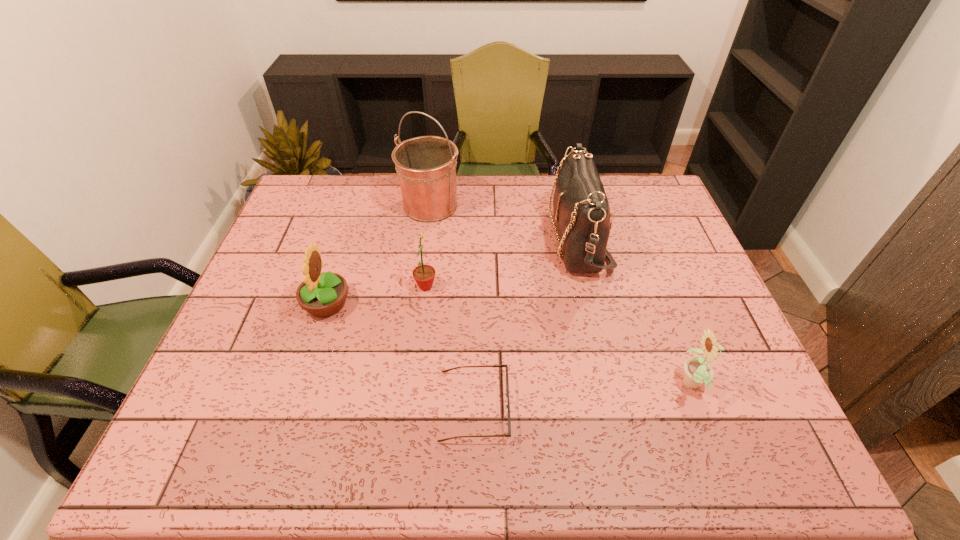
The image size is (960, 540). I want to click on the tallest object, so click(426, 166).

Image resolution: width=960 pixels, height=540 pixels. What are the coordinates of `the second tallest object` in the screenshot? It's located at (581, 208).

At what (x,y) coordinates should I click in order to perform the action: click on the fifth object from left to right. Please return your answer as a coordinate pair (x, y). Image resolution: width=960 pixels, height=540 pixels. Looking at the image, I should click on (581, 208).

I want to click on the leftmost object, so click(324, 294).

I want to click on the second sunflower from left to right, so click(424, 275).

Where is `the nearest sunflower`? This screenshot has width=960, height=540. the nearest sunflower is located at coordinates (697, 371).

Identify the location of the rightmost sunflower. (697, 371).

Where is `the shortest object`? the shortest object is located at coordinates (507, 406).

At what (x,y) coordinates should I click in order to perform the action: click on vacant area situated 0.310m on the left of the tallest object. Please return your answer as a coordinate pair (x, y). Image resolution: width=960 pixels, height=540 pixels. Looking at the image, I should click on (308, 206).

Image resolution: width=960 pixels, height=540 pixels. Find the location of `blank space located 0.250m at the front of the second tallest object with chain and zipper`. blank space located 0.250m at the front of the second tallest object with chain and zipper is located at coordinates (469, 238).